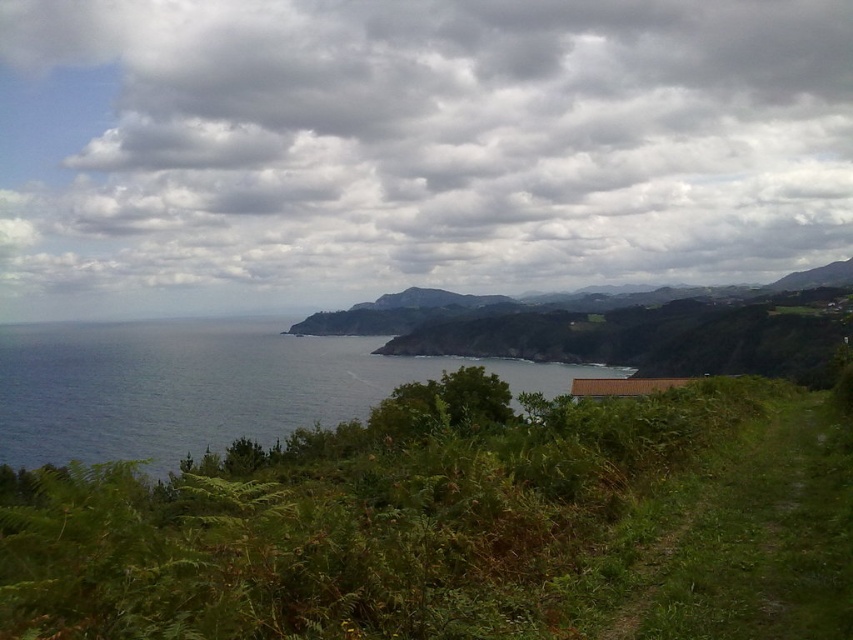
Question: Which point appears farthest from the camera in this image?

Choices:
 (A) (311, 436)
 (B) (202, 148)

Answer: (B)

Question: Is the position of green leafy shrubs at lower left less distant than that of blue water at left?

Choices:
 (A) no
 (B) yes

Answer: (B)

Question: Which object is the closest to the cloudy sky at upper center?

Choices:
 (A) green leafy shrubs at lower left
 (B) blue water at left

Answer: (B)

Question: Is the position of cloudy sky at upper center less distant than that of green leafy shrubs at lower left?

Choices:
 (A) no
 (B) yes

Answer: (A)

Question: Can you confirm if cloudy sky at upper center is positioned below green leafy shrubs at lower left?

Choices:
 (A) no
 (B) yes

Answer: (A)

Question: Which point is farther to the camera?

Choices:
 (A) (451, 428)
 (B) (618, 32)

Answer: (B)